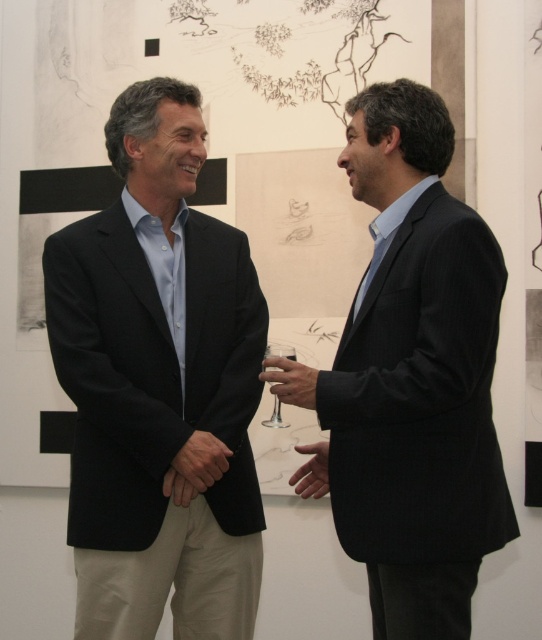
You are standing in an art gallery and see two points marked in the scene. The first point is at coordinates point (428, 253) and the second is at point (274, 417). Which point is closer to you?

Point (428, 253) is closer to the viewer than point (274, 417).

You are an art gallery attendant and need to place a new sculpture that is 0.3 meters wide. The sculpture must be placed at point (158, 385). Is there enough space there?

The point (158, 385) has a matte black suit at center which occupies the space, so placing the sculpture there may not be possible due to the existing object.